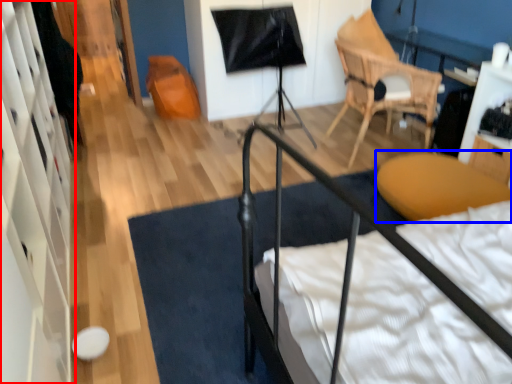
Question: Which of the following is the closest to the observer, dresser (highlighted by a red box) or furniture (highlighted by a blue box)?

Choices:
 (A) dresser
 (B) furniture

Answer: (A)